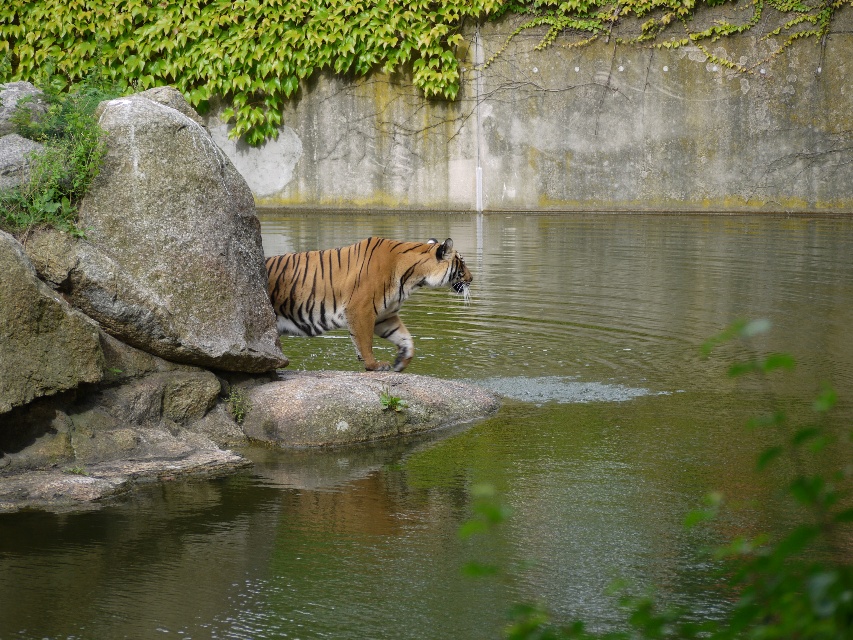
You are a painter positioned at the center of the image. You want to paint the green leafy ivy at upper center and the gray rough rock at left. Which object should you focus on first if you want to paint the wider object?

The green leafy ivy at upper center might be wider than gray rough rock at left, so you should focus on painting the green leafy ivy at upper center first.

You are a park ranger who needs to locate the green leafy ivy at upper center in the image. According to the coordinates provided, where exactly is it positioned?

The green leafy ivy at upper center is located at coordinates point [335,40].

You are a photographer positioned at the edge of the pond. You want to capture a photo where the orange striped tiger at center is in focus while the green liquid water at center is blurred. Is this possible given their positions?

The green liquid water at center is closer to the viewer than the orange striped tiger at center. To achieve a blurred background effect, the subject should be closer to the camera than the background. Since the tiger is farther away, you can adjust your camera settings to focus on the tiger while blurring the closer water.